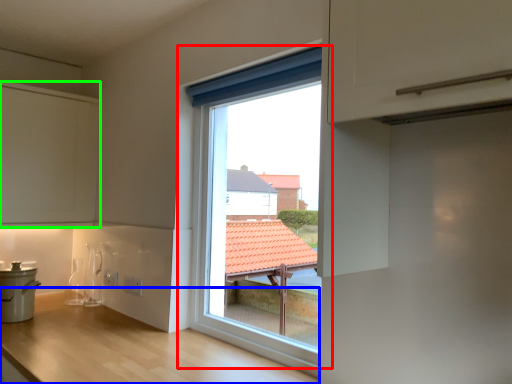
Question: Considering the real-world distances, which object is closest to window (highlighted by a red box)? counter (highlighted by a blue box) or cabinetry (highlighted by a green box).

Choices:
 (A) counter
 (B) cabinetry

Answer: (A)